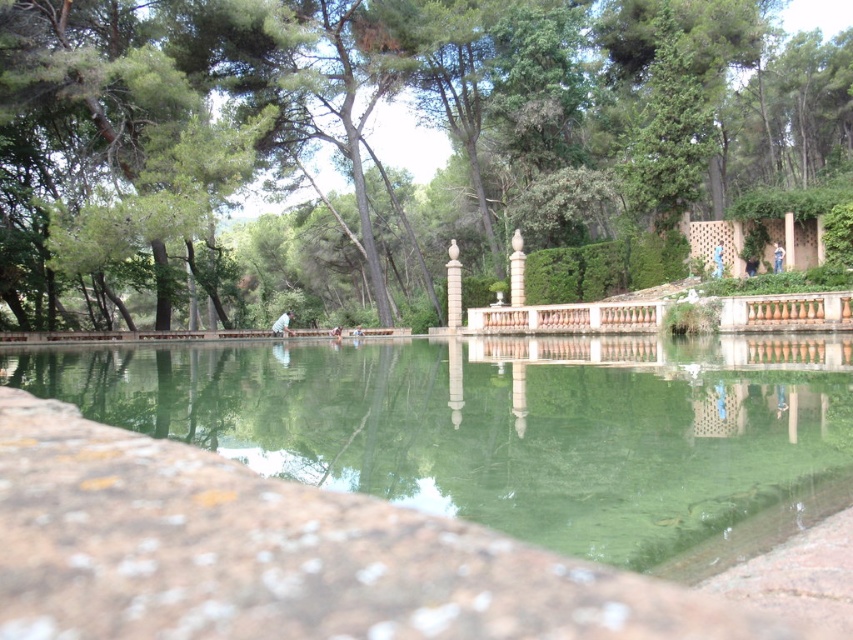
Question: Which object appears closest to the camera in this image?

Choices:
 (A) white marble pillar at center
 (B) green leafy tree at upper center

Answer: (B)

Question: Can you confirm if green stone pool at center is smaller than white marble pillar at center?

Choices:
 (A) yes
 (B) no

Answer: (B)

Question: Which point is farther to the camera?

Choices:
 (A) (724, 458)
 (B) (32, 152)
 (C) (451, 312)

Answer: (C)

Question: Is green leafy tree at upper center behind green stone pool at center?

Choices:
 (A) no
 (B) yes

Answer: (B)

Question: Which is farther from the green stone pool at center?

Choices:
 (A) green leafy tree at upper center
 (B) white marble pillar at center

Answer: (A)

Question: Can you confirm if green stone pool at center is positioned above white marble pillar at center?

Choices:
 (A) no
 (B) yes

Answer: (A)